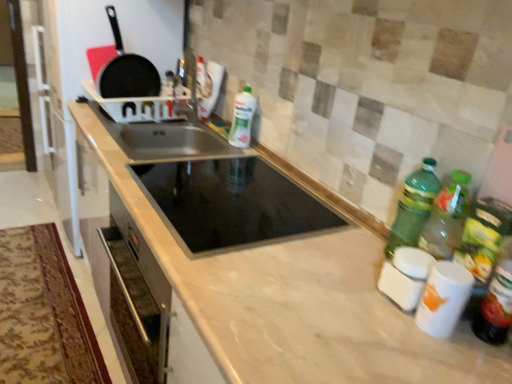
The image size is (512, 384). What do you see at coordinates (167, 140) in the screenshot? I see `stainless steel sink at center, which appears as the 2th sink when viewed from the front` at bounding box center [167, 140].

You are a GUI agent. You are given a task and a screenshot of the screen. Output one action in this format:
    pyautogui.click(x=<x>, y=<y>)
    Task: Click on the white glossy canisters at lower right
    The image size is (512, 384).
    Given the screenshot: What is the action you would take?
    pyautogui.click(x=443, y=298)

In the scene shown: In order to face white glossy canisters at lower right, should I rotate leftwards or rightwards?

You should look right and rotate roughly 23.690 degrees.

This screenshot has width=512, height=384. What do you see at coordinates (215, 188) in the screenshot? I see `black glass sink at center, the 1th sink viewed from the front` at bounding box center [215, 188].

Describe the element at coordinates (482, 245) in the screenshot. The image size is (512, 384). I see `green plastic bottle at right, which appears as the 1th bottle when viewed from the front` at that location.

What do you see at coordinates (242, 118) in the screenshot? This screenshot has width=512, height=384. I see `white glossy bottle at center, the 1th bottle in the back-to-front sequence` at bounding box center [242, 118].

In order to click on matte black frying pan at upper left in this screenshot , I will do `click(127, 70)`.

The height and width of the screenshot is (384, 512). Identify the location of stainless steel sink at center, the first sink positioned from the back. (167, 140).

Considering their positions, is black glass sink at center, the 2th sink in the back-to-front sequence, located in front of or behind white glossy bottle at center, the 1th bottle in the top-to-bottom sequence?

black glass sink at center, the 2th sink in the back-to-front sequence, is in front of white glossy bottle at center, the 1th bottle in the top-to-bottom sequence.

Is black glass sink at center, the 2th sink in the back-to-front sequence, positioned with its back to white glossy bottle at center, which is the 3th bottle in bottom-to-top order?

black glass sink at center, the 2th sink in the back-to-front sequence, does not have its back to white glossy bottle at center, which is the 3th bottle in bottom-to-top order.

From a real-world perspective, relative to white glossy bottle at center, the 1th bottle in the top-to-bottom sequence, is black glass sink at center, the 1th sink viewed from the front, vertically above or below?

black glass sink at center, the 1th sink viewed from the front, is below white glossy bottle at center, the 1th bottle in the top-to-bottom sequence.

From the image's perspective, relative to white glossy bottle at center, the 1th bottle in the top-to-bottom sequence, is black glass sink at center, the 2th sink in the back-to-front sequence, above or below?

From the image's perspective, black glass sink at center, the 2th sink in the back-to-front sequence, appears below white glossy bottle at center, the 1th bottle in the top-to-bottom sequence.

From the image's perspective, is white glossy bottle at center, the first bottle from the left, above matte black frying pan at upper left?

Incorrect, from the image's perspective, white glossy bottle at center, the first bottle from the left, is lower than matte black frying pan at upper left.

How far apart are white glossy bottle at center, the third bottle in the front-to-back sequence, and matte black frying pan at upper left?

They are 45.33 centimeters apart.

Which object is positioned more to the left, white glossy bottle at center, positioned as the third bottle in right-to-left order, or matte black frying pan at upper left?

matte black frying pan at upper left is more to the left.

Is white glossy bottle at center, the 1th bottle in the top-to-bottom sequence, positioned with its back to matte black frying pan at upper left?

That's not correct — white glossy bottle at center, the 1th bottle in the top-to-bottom sequence, is not looking away from matte black frying pan at upper left.

Who is smaller, white glossy bottle at center, positioned as the third bottle in right-to-left order, or green plastic bottle at right, marked as the 2th bottle in a back-to-front arrangement?

green plastic bottle at right, marked as the 2th bottle in a back-to-front arrangement, is smaller.

What's the angular difference between white glossy bottle at center, the third bottle in the front-to-back sequence, and green plastic bottle at right, the 2th bottle viewed from the front,'s facing directions?

They differ by 8.61 degrees in their facing directions.

Considering the sizes of objects white glossy bottle at center, the third bottle in the front-to-back sequence, and green plastic bottle at right, the 2th bottle positioned from the top, in the image provided, who is taller, white glossy bottle at center, the third bottle in the front-to-back sequence, or green plastic bottle at right, the 2th bottle positioned from the top,?

Standing taller between the two is green plastic bottle at right, the 2th bottle positioned from the top.

Is white glossy bottle at center, positioned as the third bottle in right-to-left order, facing towards green plastic bottle at right, which ranks as the second bottle in right-to-left order?

No, white glossy bottle at center, positioned as the third bottle in right-to-left order, does not turn towards green plastic bottle at right, which ranks as the second bottle in right-to-left order.

Between matte black frying pan at upper left and green plastic bottle at right, the second bottle ordered from the bottom, which one has smaller size?

Smaller between the two is green plastic bottle at right, the second bottle ordered from the bottom.

Between point (110, 19) and point (426, 185), which one is positioned in front?

Point (426, 185)

Is matte black frying pan at upper left located outside green plastic bottle at right, which ranks as the second bottle in right-to-left order?

Yes, matte black frying pan at upper left is not within green plastic bottle at right, which ranks as the second bottle in right-to-left order.

Can you tell me how much matte black frying pan at upper left and green plastic bottle at right, the 2th bottle when ordered from left to right, differ in facing direction?

They differ by 86.9 degrees in their facing directions.

What are the coordinates of `countertop on the right of matte black frying pan at upper left` in the screenshot? It's located at (298, 303).

How far apart are marble countertop at center and matte black frying pan at upper left?

marble countertop at center and matte black frying pan at upper left are 36.42 inches apart.

Consider the image. From a real-world perspective, relative to matte black frying pan at upper left, is marble countertop at center vertically above or below?

marble countertop at center is situated lower than matte black frying pan at upper left in the real world.

Choose the correct answer: Is marble countertop at center inside matte black frying pan at upper left or outside it?

marble countertop at center exists outside the volume of matte black frying pan at upper left.

Is green plastic bottle at right, the 1th bottle positioned from the right, touching white glossy bottle at center, which is the 3th bottle in bottom-to-top order?

No.

Between green plastic bottle at right, the 3th bottle from the top, and white glossy bottle at center, which is the 3th bottle in bottom-to-top order, which one has larger width?

white glossy bottle at center, which is the 3th bottle in bottom-to-top order, is wider.

How different are the orientations of green plastic bottle at right, the 3th bottle in the back-to-front sequence, and white glossy bottle at center, the 1th bottle in the top-to-bottom sequence, in degrees?

There is a 9.1-degree angle between the facing directions of green plastic bottle at right, the 3th bottle in the back-to-front sequence, and white glossy bottle at center, the 1th bottle in the top-to-bottom sequence.

From the image's perspective, is green plastic bottle at right, the 3th bottle in the back-to-front sequence, positioned above or below black glass sink at center, the 2th sink in the back-to-front sequence?

Clearly, from the image's perspective, green plastic bottle at right, the 3th bottle in the back-to-front sequence, is below black glass sink at center, the 2th sink in the back-to-front sequence.

Considering the relative sizes of green plastic bottle at right, the 3th bottle in the back-to-front sequence, and black glass sink at center, the 2th sink in the back-to-front sequence, in the image provided, is green plastic bottle at right, the 3th bottle in the back-to-front sequence, taller than black glass sink at center, the 2th sink in the back-to-front sequence,?

Correct, green plastic bottle at right, the 3th bottle in the back-to-front sequence, is much taller as black glass sink at center, the 2th sink in the back-to-front sequence.

Does green plastic bottle at right, which appears as the 1th bottle when ordered from the bottom, lie behind black glass sink at center, the 2th sink in the back-to-front sequence?

That is False.

Image resolution: width=512 pixels, height=384 pixels. I want to click on the 1st bottle to the right of the black glass sink at center, the 1th sink viewed from the front, starting your count from the anchor, so click(x=242, y=118).

From the image's perspective, starting from the matte black frying pan at upper left, which bottle is the 1st one below? Please provide its 2D coordinates.

[(242, 118)]

Looking at the image, which one is located closer to black glass sink at center, the 2th sink in the back-to-front sequence, white glossy canisters at lower right or white glossy bottle at center, the first bottle from the left?

white glossy bottle at center, the first bottle from the left, is closer to black glass sink at center, the 2th sink in the back-to-front sequence.

When comparing their distances from white glossy canisters at lower right, does green plastic bottle at right, the 3th bottle from the top, or green plastic bottle at right, marked as the 2th bottle in a back-to-front arrangement, seem further?

Based on the image, green plastic bottle at right, marked as the 2th bottle in a back-to-front arrangement, appears to be further to white glossy canisters at lower right.

From the image, which object appears to be nearer to marble countertop at center, stainless steel sink at center, which appears as the 2th sink when viewed from the front, or black glass sink at center, the 2th sink in the back-to-front sequence?

Based on the image, black glass sink at center, the 2th sink in the back-to-front sequence, appears to be nearer to marble countertop at center.

Based on the photo, when comparing their distances from matte black frying pan at upper left, does stainless steel sink at center, which appears as the 2th sink when viewed from the front, or green plastic bottle at right, marked as the 2th bottle in a back-to-front arrangement, seem closer?

stainless steel sink at center, which appears as the 2th sink when viewed from the front, is closer to matte black frying pan at upper left.

When comparing their distances from marble countertop at center, does white glossy canisters at lower right or green plastic bottle at right, the 3th bottle from the top, seem closer?

white glossy canisters at lower right is positioned closer to the anchor marble countertop at center.

Based on their spatial positions, is black glass sink at center, the 1th sink viewed from the front, or stainless steel sink at center, which appears as the 2th sink when viewed from the front, further from green plastic bottle at right, the second bottle ordered from the bottom?

The object further to green plastic bottle at right, the second bottle ordered from the bottom, is stainless steel sink at center, which appears as the 2th sink when viewed from the front.

Considering their positions, is white glossy canisters at lower right positioned closer to marble countertop at center than matte black frying pan at upper left?

white glossy canisters at lower right is positioned closer to the anchor marble countertop at center.

Looking at the image, which one is located closer to stainless steel sink at center, the first sink positioned from the back, black glass sink at center, the 1th sink viewed from the front, or matte black frying pan at upper left?

Among the two, black glass sink at center, the 1th sink viewed from the front, is located nearer to stainless steel sink at center, the first sink positioned from the back.

You are a GUI agent. You are given a task and a screenshot of the screen. Output one action in this format:
    pyautogui.click(x=<x>, y=<y>)
    Task: Click on the bottle between green plastic bottle at right, the 1th bottle positioned from the right, and white glossy bottle at center, the 1th bottle in the top-to-bottom sequence, along the z-axis
    Image resolution: width=512 pixels, height=384 pixels.
    Given the screenshot: What is the action you would take?
    pyautogui.click(x=413, y=207)

This screenshot has width=512, height=384. In order to click on sink between stainless steel sink at center, the first sink positioned from the back, and green plastic bottle at right, which is counted as the 3th bottle, starting from the left, in the horizontal direction in this screenshot , I will do `click(215, 188)`.

Image resolution: width=512 pixels, height=384 pixels. Find the location of `appliance between black glass sink at center, the 1th sink viewed from the front, and green plastic bottle at right, which is counted as the 3th bottle, starting from the left, in the horizontal direction`. appliance between black glass sink at center, the 1th sink viewed from the front, and green plastic bottle at right, which is counted as the 3th bottle, starting from the left, in the horizontal direction is located at coordinates (443, 298).

Locate an element on the screen. This screenshot has width=512, height=384. appliance between matte black frying pan at upper left and green plastic bottle at right, which is counted as the 3th bottle, starting from the left, in the horizontal direction is located at coordinates (443, 298).